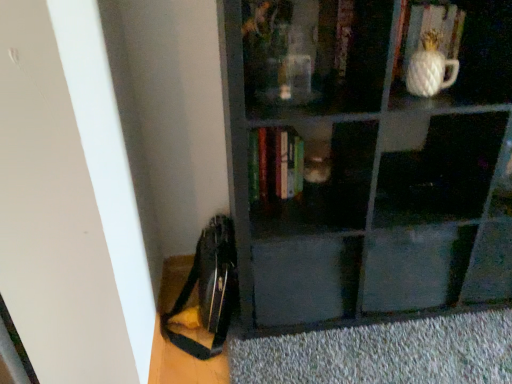
Question: From the image's perspective, is matte black drawer at center on top of matte black bookshelf at center?

Choices:
 (A) yes
 (B) no

Answer: (B)

Question: From the image's perspective, does matte black drawer at center appear lower than matte black bookshelf at center?

Choices:
 (A) no
 (B) yes

Answer: (B)

Question: Is matte black drawer at center to the left of matte black bookshelf at center from the viewer's perspective?

Choices:
 (A) no
 (B) yes

Answer: (B)

Question: Considering the relative sizes of matte black drawer at center and matte black bookshelf at center in the image provided, is matte black drawer at center thinner than matte black bookshelf at center?

Choices:
 (A) no
 (B) yes

Answer: (B)

Question: Considering the relative sizes of matte black drawer at center and matte black bookshelf at center in the image provided, is matte black drawer at center smaller than matte black bookshelf at center?

Choices:
 (A) yes
 (B) no

Answer: (A)

Question: Is wooden book at upper center, the second book positioned from the left, in front of or behind white textured vase at upper right in the image?

Choices:
 (A) front
 (B) behind

Answer: (B)

Question: From the image's perspective, is wooden book at upper center, which is the 2th book from right to left, above or below white textured vase at upper right?

Choices:
 (A) above
 (B) below

Answer: (A)

Question: Based on their sizes in the image, would you say wooden book at upper center, which is the 2th book from right to left, is bigger or smaller than white textured vase at upper right?

Choices:
 (A) small
 (B) big

Answer: (B)

Question: Is point (338, 74) closer or farther from the camera than point (425, 56)?

Choices:
 (A) farther
 (B) closer

Answer: (A)

Question: In the image, is wooden book at upper center, the second book positioned from the left, on the left side or the right side of gray textured doormat at lower right?

Choices:
 (A) right
 (B) left

Answer: (B)

Question: From the image's perspective, is wooden book at upper center, the second book positioned from the left, above or below gray textured doormat at lower right?

Choices:
 (A) below
 (B) above

Answer: (B)

Question: Considering the positions of wooden book at upper center, which is the 2th book from right to left, and gray textured doormat at lower right in the image, is wooden book at upper center, which is the 2th book from right to left, taller or shorter than gray textured doormat at lower right?

Choices:
 (A) short
 (B) tall

Answer: (B)

Question: Is point (345, 46) positioned closer to the camera than point (356, 379)?

Choices:
 (A) closer
 (B) farther

Answer: (A)

Question: In the image, is matte black drawer at center on the left side or the right side of matte black bookshelf at center?

Choices:
 (A) right
 (B) left

Answer: (B)

Question: Considering the positions of matte black drawer at center and matte black bookshelf at center in the image, is matte black drawer at center bigger or smaller than matte black bookshelf at center?

Choices:
 (A) big
 (B) small

Answer: (B)